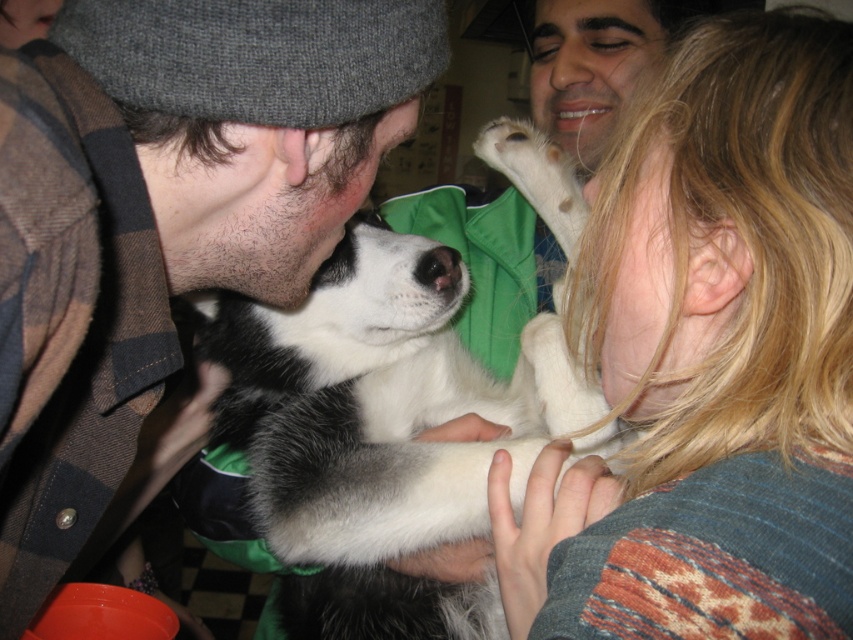
Is fluffy gray hat at upper left above black and white fur at center?

Correct, fluffy gray hat at upper left is located above black and white fur at center.

Image resolution: width=853 pixels, height=640 pixels. What do you see at coordinates (166, 216) in the screenshot?
I see `fluffy gray hat at upper left` at bounding box center [166, 216].

You are a GUI agent. You are given a task and a screenshot of the screen. Output one action in this format:
    pyautogui.click(x=<x>, y=<y>)
    Task: Click on the fluffy gray hat at upper left
    
    Given the screenshot: What is the action you would take?
    pyautogui.click(x=166, y=216)

Where is `fluffy gray hat at upper left`? fluffy gray hat at upper left is located at coordinates (x=166, y=216).

Is blonde hair at upper right closer to camera compared to fluffy gray hat at upper left?

Yes.

Does point (706, 36) lie in front of point (207, 209)?

Yes.

This screenshot has width=853, height=640. Identify the location of blonde hair at upper right. (711, 358).

Is blonde hair at upper right closer to the viewer compared to matte skin nose at center?

That is True.

Which of these two, blonde hair at upper right or matte skin nose at center, stands shorter?

matte skin nose at center is shorter.

Between point (766, 83) and point (579, 90), which one is positioned behind?

The point (579, 90) is behind.

I want to click on blonde hair at upper right, so click(x=711, y=358).